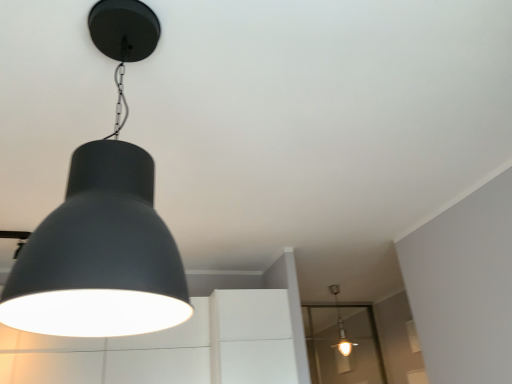
What is the approximate height of matte white bulb at center, the 2th lamp when ordered from left to right?

It is 78.25 centimeters.

This screenshot has height=384, width=512. Describe the element at coordinates (341, 326) in the screenshot. I see `matte white bulb at center, the 2th lamp in the front-to-back sequence` at that location.

The height and width of the screenshot is (384, 512). I want to click on transparent glass door at lower right, so click(x=337, y=347).

This screenshot has height=384, width=512. Find the location of `glass door that is on the right side of matte black lampshade at upper left, which is the 2th lamp in right-to-left order`. glass door that is on the right side of matte black lampshade at upper left, which is the 2th lamp in right-to-left order is located at coordinates (337, 347).

Is matte black lampshade at upper left, positioned as the 2th lamp in back-to-front order, located within transparent glass door at lower right?

Definitely not — matte black lampshade at upper left, positioned as the 2th lamp in back-to-front order, is not inside transparent glass door at lower right.

Is transparent glass door at lower right turned away from matte black lampshade at upper left, the second lamp ordered from the bottom?

No, transparent glass door at lower right is not facing the opposite direction of matte black lampshade at upper left, the second lamp ordered from the bottom.

Can you confirm if transparent glass door at lower right is shorter than matte white bulb at center, which is counted as the first lamp, starting from the bottom?

In fact, transparent glass door at lower right may be taller than matte white bulb at center, which is counted as the first lamp, starting from the bottom.

Looking at this image, is transparent glass door at lower right not near matte white bulb at center, the second lamp from the top?

transparent glass door at lower right is near matte white bulb at center, the second lamp from the top, not far away.

From the image's perspective, is transparent glass door at lower right under matte white bulb at center, which is counted as the first lamp, starting from the back?

Correct, transparent glass door at lower right appears lower than matte white bulb at center, which is counted as the first lamp, starting from the back, in the image.

Is transparent glass door at lower right positioned beyond the bounds of matte white bulb at center, the 2th lamp in the front-to-back sequence?

Yes, transparent glass door at lower right is outside of matte white bulb at center, the 2th lamp in the front-to-back sequence.

Which point is more distant from viewer, [71,238] or [351,351]?

The point [351,351] is farther from the camera.

Would you say matte black lampshade at upper left, positioned as the 2th lamp in back-to-front order, is inside or outside matte white bulb at center, the second lamp from the top?

matte black lampshade at upper left, positioned as the 2th lamp in back-to-front order, lies outside matte white bulb at center, the second lamp from the top.

From the image's perspective, is matte black lampshade at upper left, positioned as the first lamp in front-to-back order, on matte white bulb at center, which is counted as the first lamp, starting from the back?

Yes, from the image's perspective, matte black lampshade at upper left, positioned as the first lamp in front-to-back order, is over matte white bulb at center, which is counted as the first lamp, starting from the back.

Is matte black lampshade at upper left, the second lamp ordered from the bottom, further to camera compared to matte white bulb at center, the second lamp from the top?

No.

Considering the relative positions of matte black lampshade at upper left, which is the 2th lamp in right-to-left order, and transparent glass door at lower right in the image provided, is matte black lampshade at upper left, which is the 2th lamp in right-to-left order, to the left of transparent glass door at lower right from the viewer's perspective?

Correct, you'll find matte black lampshade at upper left, which is the 2th lamp in right-to-left order, to the left of transparent glass door at lower right.

Locate an element on the screen. glass door below the matte black lampshade at upper left, the second lamp ordered from the bottom (from the image's perspective) is located at coordinates (337, 347).

From the image's perspective, relative to transparent glass door at lower right, is matte black lampshade at upper left, which is the 2th lamp in right-to-left order, above or below?

From the image's perspective, matte black lampshade at upper left, which is the 2th lamp in right-to-left order, appears above transparent glass door at lower right.

Considering the sizes of objects matte black lampshade at upper left, the second lamp ordered from the bottom, and transparent glass door at lower right in the image provided, who is taller, matte black lampshade at upper left, the second lamp ordered from the bottom, or transparent glass door at lower right?

With more height is matte black lampshade at upper left, the second lamp ordered from the bottom.

From the image's perspective, would you say matte white bulb at center, the 2th lamp in the front-to-back sequence, is shown under transparent glass door at lower right?

No, from the image's perspective, matte white bulb at center, the 2th lamp in the front-to-back sequence, is not below transparent glass door at lower right.

Would you consider matte white bulb at center, which is counted as the first lamp, starting from the back, to be distant from transparent glass door at lower right?

That's not correct — matte white bulb at center, which is counted as the first lamp, starting from the back, is a little close to transparent glass door at lower right.

Considering the relative positions of matte white bulb at center, the second lamp from the top, and transparent glass door at lower right in the image provided, is matte white bulb at center, the second lamp from the top, to the left of transparent glass door at lower right from the viewer's perspective?

Indeed, matte white bulb at center, the second lamp from the top, is positioned on the left side of transparent glass door at lower right.

Looking at this image, who is smaller, matte white bulb at center, the 2th lamp in the front-to-back sequence, or transparent glass door at lower right?

Smaller between the two is matte white bulb at center, the 2th lamp in the front-to-back sequence.

Considering the relative positions of matte white bulb at center, placed as the first lamp when sorted from right to left, and matte black lampshade at upper left, which is the 2th lamp in right-to-left order, in the image provided, is matte white bulb at center, placed as the first lamp when sorted from right to left, to the left of matte black lampshade at upper left, which is the 2th lamp in right-to-left order, from the viewer's perspective?

Incorrect, matte white bulb at center, placed as the first lamp when sorted from right to left, is not on the left side of matte black lampshade at upper left, which is the 2th lamp in right-to-left order.

Does matte white bulb at center, which is counted as the first lamp, starting from the bottom, turn towards matte black lampshade at upper left, the 1th lamp positioned from the top?

No.

Is matte black lampshade at upper left, the second lamp ordered from the bottom, completely or partially inside matte white bulb at center, which is counted as the first lamp, starting from the bottom?

No, matte white bulb at center, which is counted as the first lamp, starting from the bottom, does not contain matte black lampshade at upper left, the second lamp ordered from the bottom.

The image size is (512, 384). I want to click on the 2nd lamp in front of the transparent glass door at lower right, so click(103, 224).

Where is `the 1st lamp counting from the left side of the transparent glass door at lower right`? The width and height of the screenshot is (512, 384). the 1st lamp counting from the left side of the transparent glass door at lower right is located at coordinates (341, 326).

Estimate the real-world distances between objects in this image. Which object is further from transparent glass door at lower right, matte white bulb at center, the 2th lamp when ordered from left to right, or matte black lampshade at upper left, the second lamp ordered from the bottom?

matte black lampshade at upper left, the second lamp ordered from the bottom, is further to transparent glass door at lower right.

Considering their positions, is transparent glass door at lower right positioned further to matte black lampshade at upper left, the 1th lamp positioned from the top, than matte white bulb at center, which is counted as the first lamp, starting from the back?

Among the two, matte white bulb at center, which is counted as the first lamp, starting from the back, is located further to matte black lampshade at upper left, the 1th lamp positioned from the top.

Which object lies nearer to the anchor point transparent glass door at lower right, matte black lampshade at upper left, the second lamp ordered from the bottom, or matte white bulb at center, the 2th lamp in the front-to-back sequence?

matte white bulb at center, the 2th lamp in the front-to-back sequence, is positioned closer to the anchor transparent glass door at lower right.

Which object lies further to the anchor point matte black lampshade at upper left, which is the 2th lamp in right-to-left order, matte white bulb at center, placed as the first lamp when sorted from right to left, or transparent glass door at lower right?

matte white bulb at center, placed as the first lamp when sorted from right to left, lies further to matte black lampshade at upper left, which is the 2th lamp in right-to-left order, than the other object.

From the image, which object appears to be nearer to matte white bulb at center, the 2th lamp in the front-to-back sequence, transparent glass door at lower right or matte black lampshade at upper left, the 1th lamp in the left-to-right sequence?

Among the two, transparent glass door at lower right is located nearer to matte white bulb at center, the 2th lamp in the front-to-back sequence.

Looking at the image, which one is located closer to matte white bulb at center, the 2th lamp in the front-to-back sequence, matte black lampshade at upper left, which is the 2th lamp in right-to-left order, or transparent glass door at lower right?

transparent glass door at lower right lies closer to matte white bulb at center, the 2th lamp in the front-to-back sequence, than the other object.

Locate an element on the screen. The image size is (512, 384). lamp located between matte black lampshade at upper left, positioned as the first lamp in front-to-back order, and transparent glass door at lower right in the depth direction is located at coordinates (341, 326).